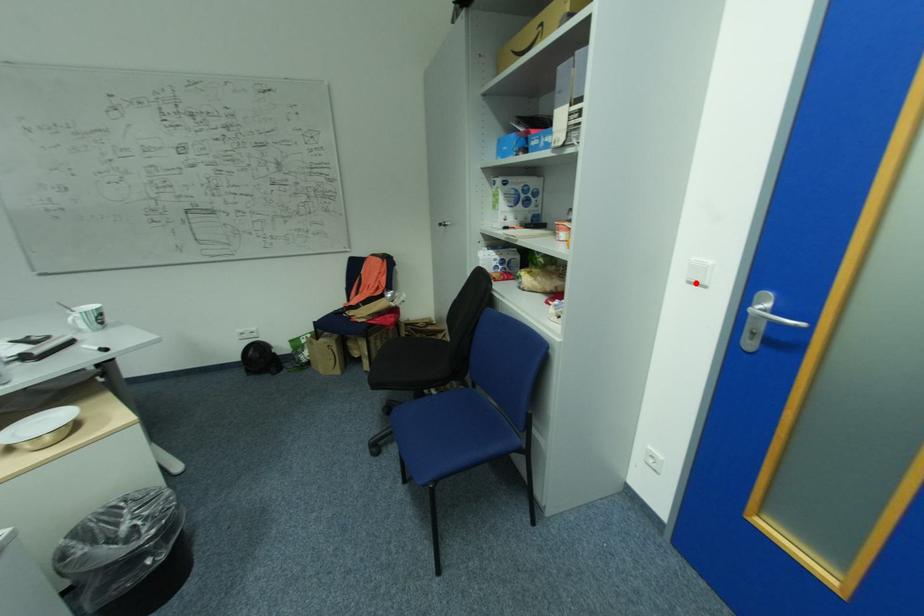
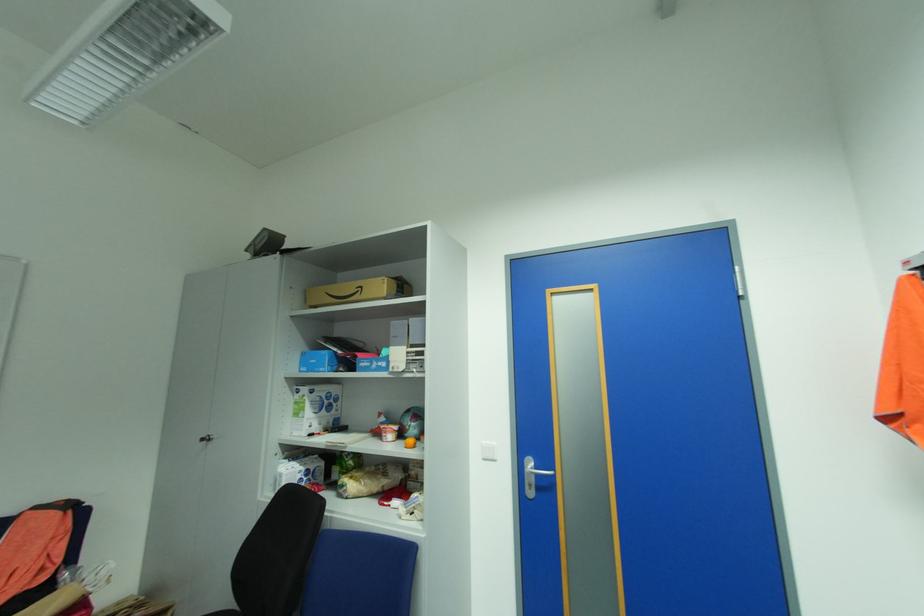
In the second image, find the point that corresponds to the highlighted location in the first image.

(492, 460)